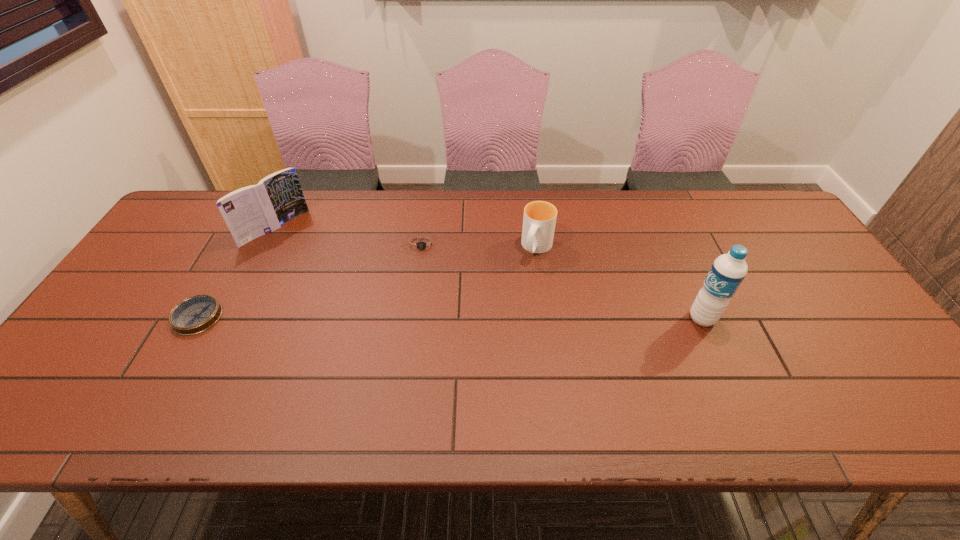
The image size is (960, 540). What are the coordinates of `compass` in the screenshot? It's located at (196, 314).

Identify the location of the tallest object. The width and height of the screenshot is (960, 540). (727, 272).

In order to click on the rightmost object in this screenshot , I will do `click(727, 272)`.

This screenshot has width=960, height=540. I want to click on watch, so click(423, 244).

Find the location of a particular element. cup is located at coordinates (539, 220).

Identify the location of the third shortest object. The height and width of the screenshot is (540, 960). (539, 220).

Find the location of a particular element. This screenshot has height=540, width=960. book is located at coordinates (252, 211).

Where is `vacant area situated on the front of the compass`? The width and height of the screenshot is (960, 540). vacant area situated on the front of the compass is located at coordinates (169, 367).

Locate an element on the screen. This screenshot has height=540, width=960. free space located 0.140m on the label of the water bottle is located at coordinates (634, 319).

At what (x,y) coordinates should I click in order to perform the action: click on free region located 0.060m on the label of the water bottle. Please return your answer as a coordinate pair (x, y). The width and height of the screenshot is (960, 540). Looking at the image, I should click on [x=664, y=319].